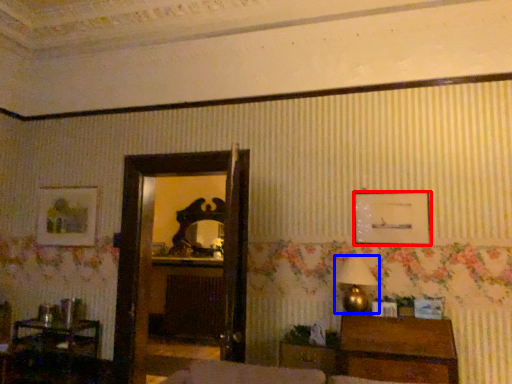
Question: Which of the following is the closest to the observer, picture frame (highlighted by a red box) or table lamp (highlighted by a blue box)?

Choices:
 (A) picture frame
 (B) table lamp

Answer: (B)